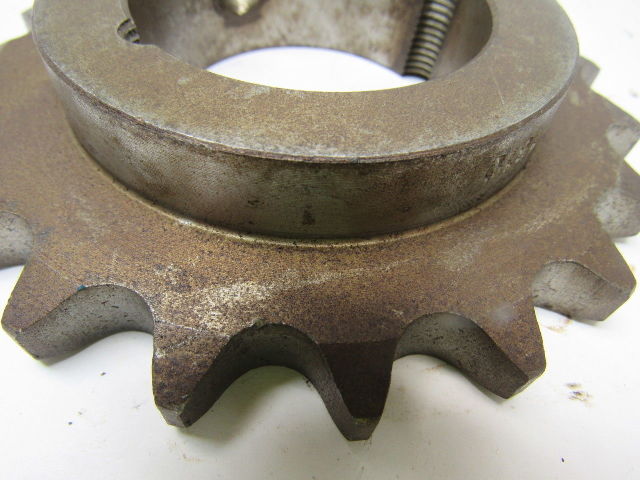
Identify the location of table. (x=493, y=445).